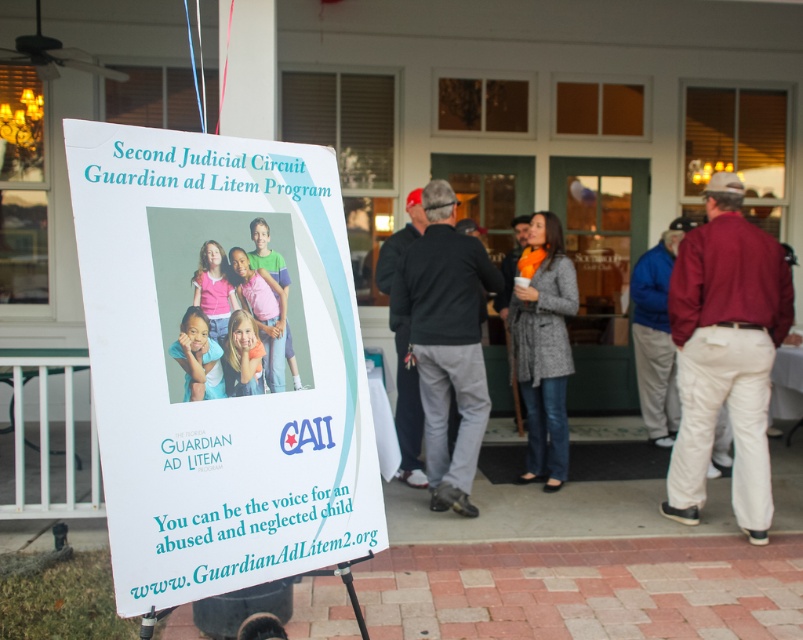
You are at the event and need to read the white paper sign at center and the black sweater at center. Which one is located to the left when facing the entrance?

The white paper sign at center is positioned on the left side of the black sweater at center, so when facing the entrance, the white paper sign at center is to the left of the black sweater at center.

You are standing in the outdoor event area and see the large informational sign for the Second Judicial Circuit Guardian ad Litem Program and the point at coordinates (226, 396). According to the scene, where exactly is the point located?

The point at coordinates (226, 396) is on the white paper sign at center.